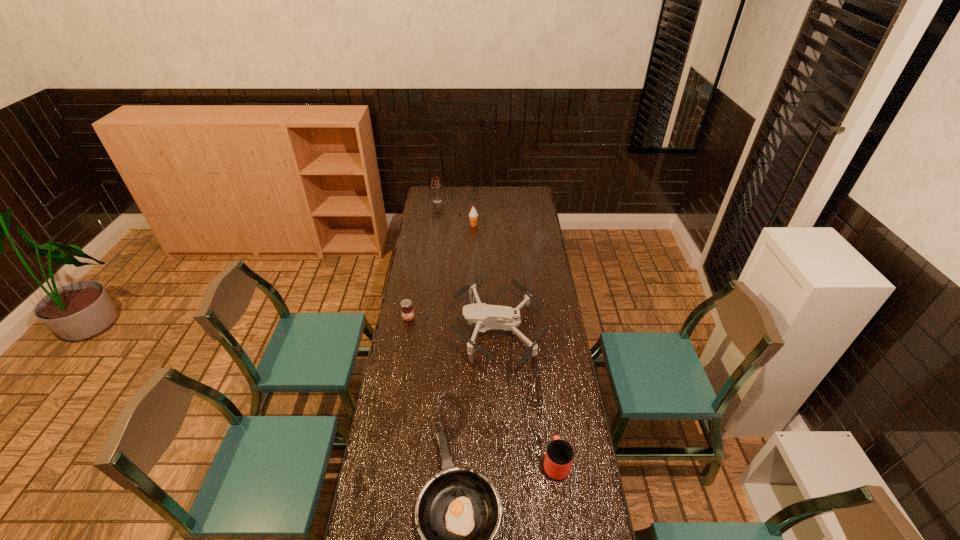
Locate an element on the screen. Image resolution: width=960 pixels, height=540 pixels. free location located 0.300m on the handle side of the cup is located at coordinates (544, 377).

What are the coordinates of `vacant space situated 0.320m on the handle side of the cup` in the screenshot? It's located at (543, 373).

In order to click on vacant space located on the handle side of the cup in this screenshot , I will do `click(547, 398)`.

This screenshot has width=960, height=540. Identify the location of vacant position located on the label side of the jam. (405, 336).

Find the location of a particular element. object positioned at the far edge is located at coordinates (436, 185).

Image resolution: width=960 pixels, height=540 pixels. I want to click on wineglass located at the left edge, so click(436, 185).

Where is `jam that is at the left edge`? The image size is (960, 540). jam that is at the left edge is located at coordinates (407, 311).

I want to click on drone present at the right edge, so click(x=485, y=317).

This screenshot has height=540, width=960. In order to click on cup that is at the right edge in this screenshot , I will do `click(559, 455)`.

You are a GUI agent. You are given a task and a screenshot of the screen. Output one action in this format:
    pyautogui.click(x=<x>, y=<y>)
    Task: Click on the object that is positioned at the far left corner
    The width and height of the screenshot is (960, 540).
    Given the screenshot: What is the action you would take?
    pyautogui.click(x=436, y=185)